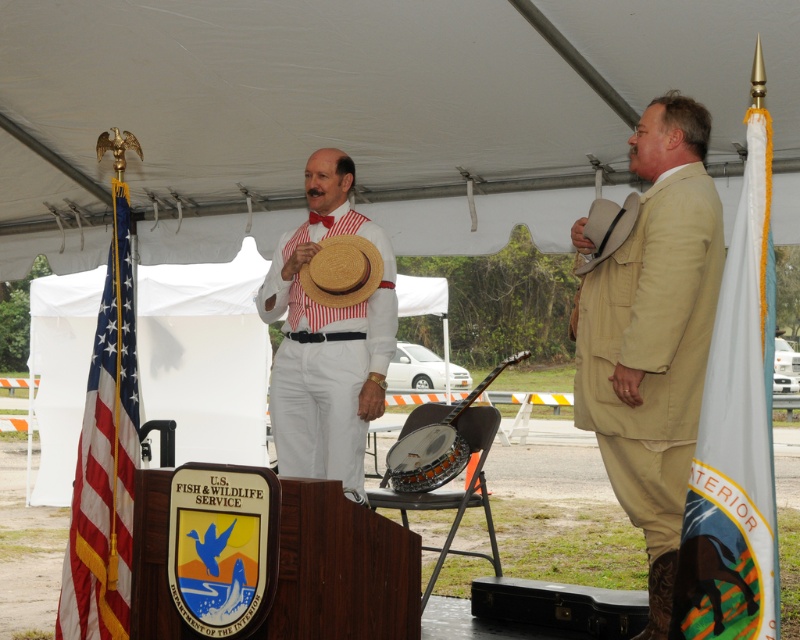
Question: Does tan fabric suit at right appear over white striped fabric at center?

Choices:
 (A) no
 (B) yes

Answer: (A)

Question: Is white striped fabric at center above orange wood banjo at center?

Choices:
 (A) no
 (B) yes

Answer: (B)

Question: Which point appears farthest from the camera in this image?

Choices:
 (A) (496, 371)
 (B) (608, 221)
 (C) (736, 570)
 (D) (314, 276)

Answer: (A)

Question: Estimate the real-world distances between objects in this image. Which object is farther from the red-white striped fabric flag at left?

Choices:
 (A) strawmaterial/texturehat at upper right
 (B) tan fabric suit at right
 (C) strawhat at center

Answer: (A)

Question: Estimate the real-world distances between objects in this image. Which object is closer to the strawmaterial/texturehat at upper right?

Choices:
 (A) white fabric flag at right
 (B) orange wood banjo at center

Answer: (A)

Question: Can you confirm if white striped fabric at center is thinner than orange wood banjo at center?

Choices:
 (A) yes
 (B) no

Answer: (B)